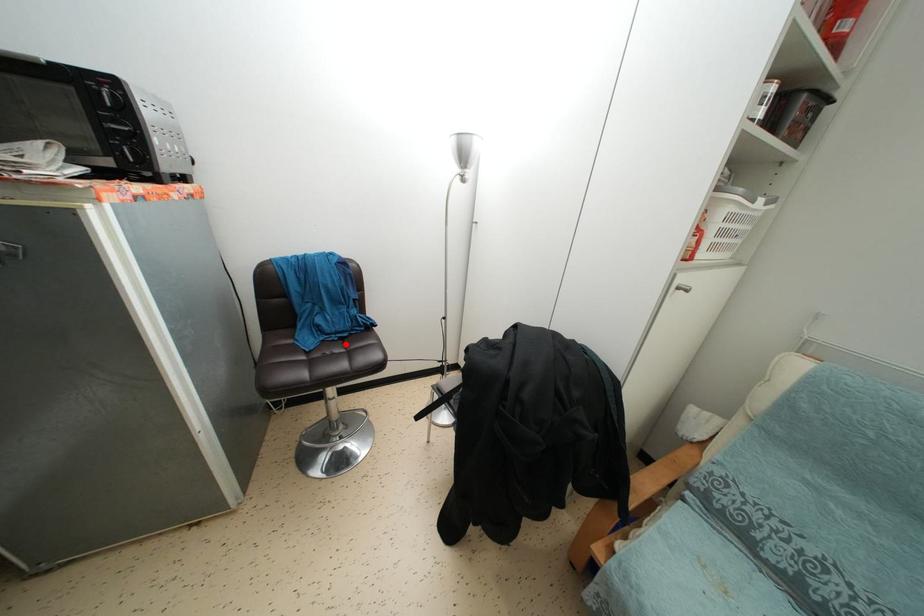
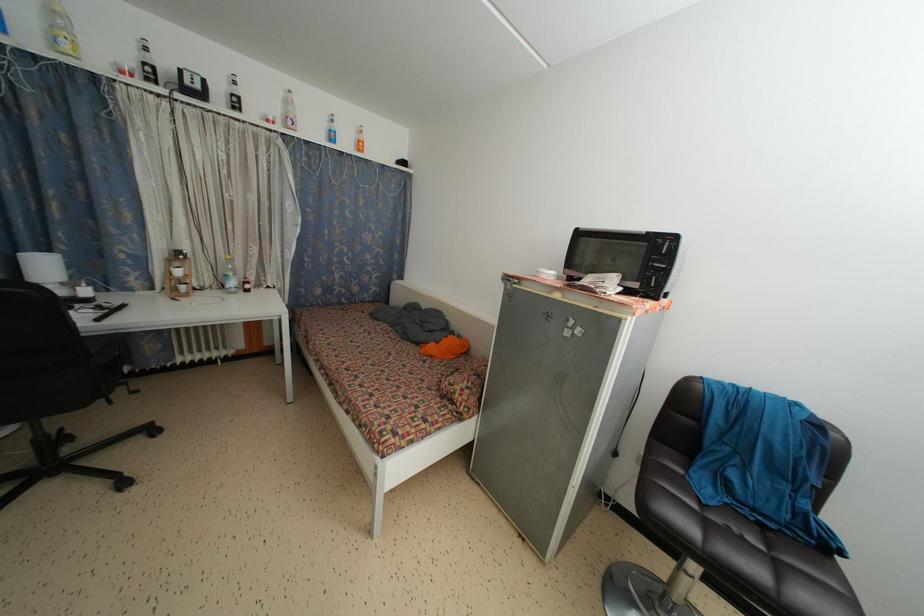
In the second image, find the point that corresponds to the highlighted location in the first image.

(767, 532)